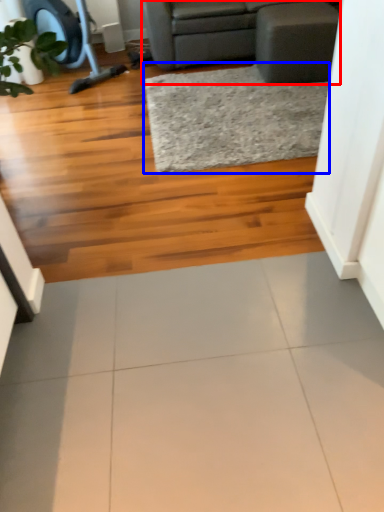
Question: Which object appears closest to the camera in this image, studio couch (highlighted by a red box) or mat (highlighted by a blue box)?

Choices:
 (A) studio couch
 (B) mat

Answer: (B)